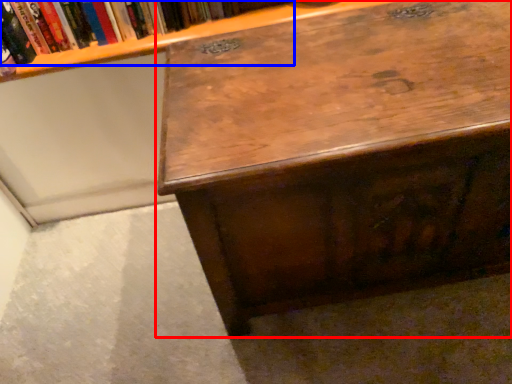
Question: Which point is closer to the camera, desk (highlighted by a red box) or book (highlighted by a blue box)?

Choices:
 (A) desk
 (B) book

Answer: (A)